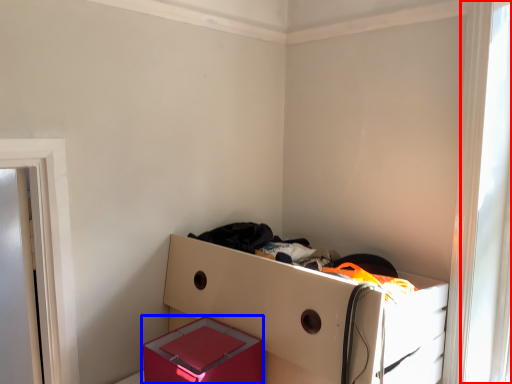
Question: Which of the following is the farthest to the observer, window (highlighted by a red box) or box (highlighted by a blue box)?

Choices:
 (A) window
 (B) box

Answer: (A)